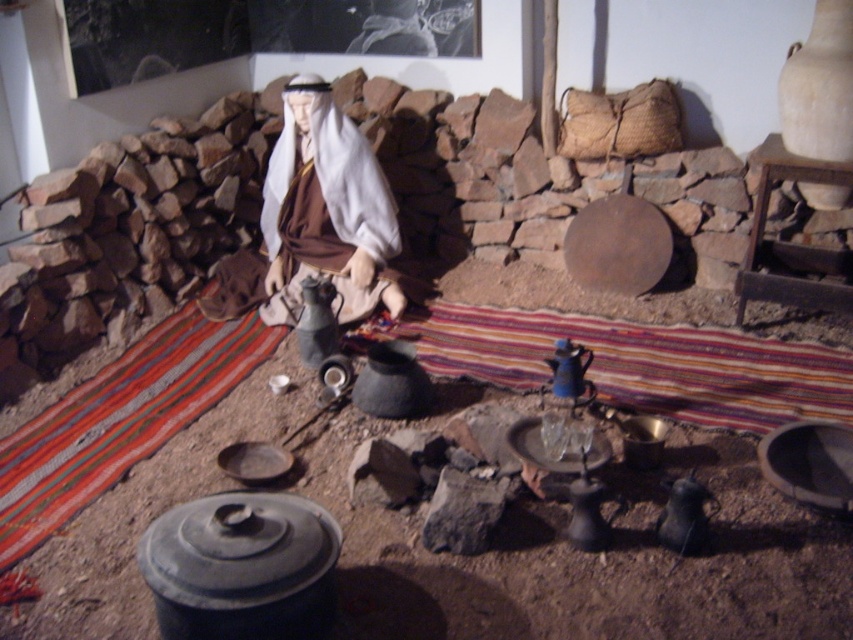
Question: Is matte black pot at center bigger than blue glazed earthenware teapot at center?

Choices:
 (A) no
 (B) yes

Answer: (B)

Question: Which object is farther from the camera taking this photo?

Choices:
 (A) blue glazed earthenware teapot at center
 (B) matte black pot at center

Answer: (A)

Question: Can you confirm if matte black pot at center is positioned below white matte figure at center?

Choices:
 (A) no
 (B) yes

Answer: (B)

Question: Considering the relative positions of matte black pot at center and white matte figure at center in the image provided, where is matte black pot at center located with respect to white matte figure at center?

Choices:
 (A) right
 (B) left

Answer: (A)

Question: Among these objects, which one is farthest from the camera?

Choices:
 (A) matte black pot at center
 (B) blue glazed earthenware teapot at center
 (C) white matte figure at center

Answer: (C)

Question: Which object is the farthest from the matte black pot at center?

Choices:
 (A) blue glazed earthenware teapot at center
 (B) white matte figure at center

Answer: (B)